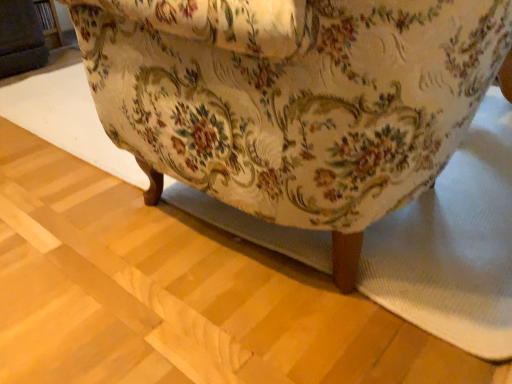
The image size is (512, 384). Describe the element at coordinates (294, 99) in the screenshot. I see `floral fabric armchair at center` at that location.

The image size is (512, 384). What are the coordinates of `floral fabric armchair at center` in the screenshot? It's located at [x=294, y=99].

Where is `floral fabric armchair at center`? floral fabric armchair at center is located at coordinates (294, 99).